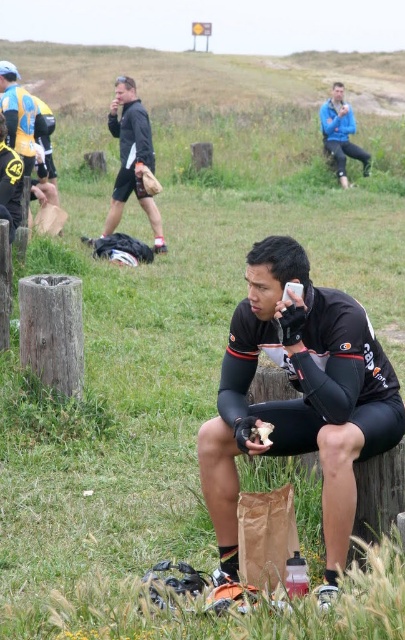
Who is more distant from viewer, (336, 131) or (259, 426)?

Positioned behind is point (336, 131).

Based on the photo, how far apart are blue fabric jacket at upper center and white paper bag at center?

blue fabric jacket at upper center and white paper bag at center are 17.31 meters apart.

Is point (332, 144) positioned behind point (257, 433)?

Yes, it is.

At what (x,y) coordinates should I click in order to perform the action: click on blue fabric jacket at upper center. Please return your answer as a coordinate pair (x, y). The image size is (405, 640). Looking at the image, I should click on (341, 132).

Who is taller, black matte jacket at left or blue fabric jacket at upper center?

black matte jacket at left is taller.

Who is positioned more to the right, black matte jacket at left or blue fabric jacket at upper center?

Positioned to the right is blue fabric jacket at upper center.

Locate an element on the screen. black matte jacket at left is located at coordinates (132, 157).

Does black matte shorts at center have a larger size compared to white paper bag at center?

Correct, black matte shorts at center is larger in size than white paper bag at center.

Does black matte shorts at center have a lesser width compared to white paper bag at center?

In fact, black matte shorts at center might be wider than white paper bag at center.

Is point (343, 557) closer to camera compared to point (264, 422)?

Yes, it is.

Find the location of a particular element. Image resolution: width=405 pixels, height=640 pixels. black matte shorts at center is located at coordinates (298, 397).